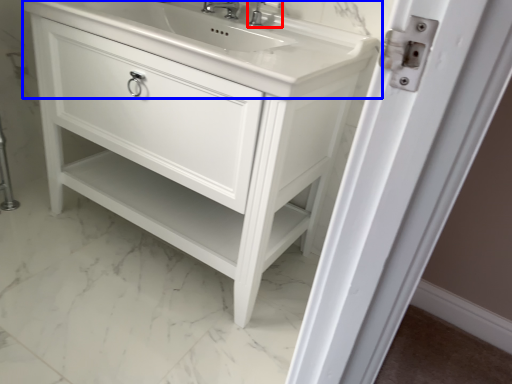
Question: Which object is further to the camera taking this photo, tap (highlighted by a red box) or counter top (highlighted by a blue box)?

Choices:
 (A) tap
 (B) counter top

Answer: (A)